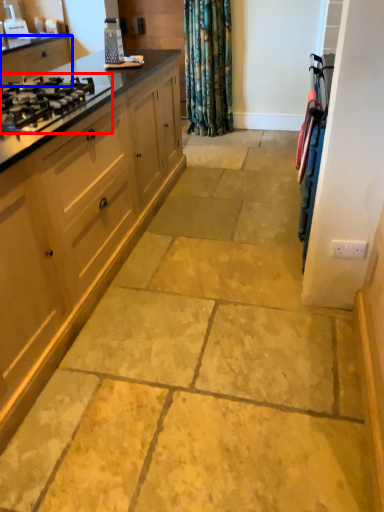
Question: Which of the following is the farthest to the observer, gas stove (highlighted by a red box) or cabinetry (highlighted by a blue box)?

Choices:
 (A) gas stove
 (B) cabinetry

Answer: (B)